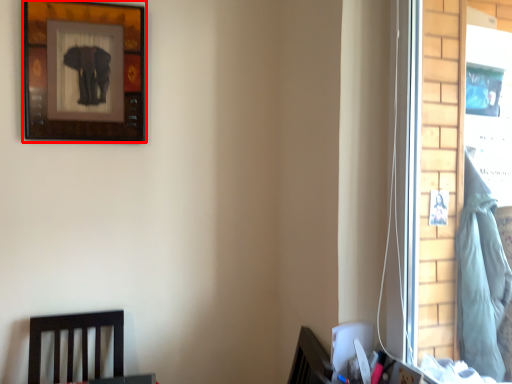
Question: From the image, what is the correct spatial relationship of picture frame (annotated by the red box) in relation to laundry?

Choices:
 (A) right
 (B) left

Answer: (B)